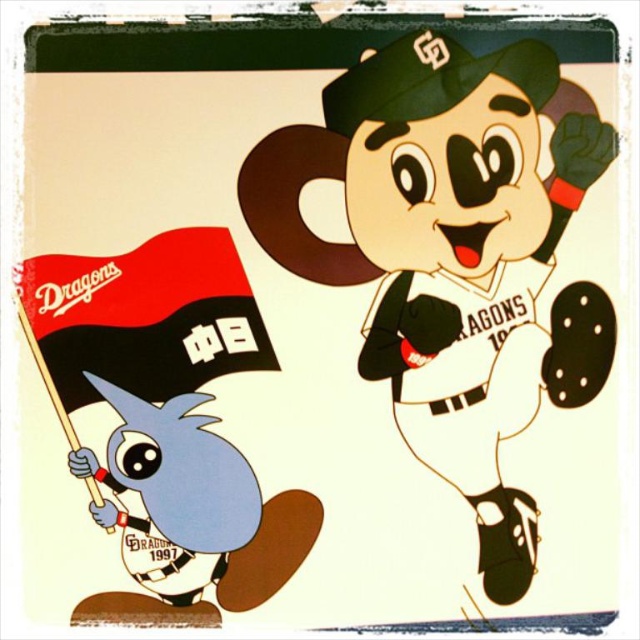
Question: Does black fabric flag at lower left appear on the right side of blue matte bird at lower left?

Choices:
 (A) yes
 (B) no

Answer: (B)

Question: Among these objects, which one is farthest from the camera?

Choices:
 (A) black fabric flag at lower left
 (B) blue matte bird at lower left
 (C) matte black mascot at right

Answer: (C)

Question: Estimate the real-world distances between objects in this image. Which object is closer to the blue matte bird at lower left?

Choices:
 (A) black fabric flag at lower left
 (B) matte black mascot at right

Answer: (A)

Question: Is matte black mascot at right behind blue matte bird at lower left?

Choices:
 (A) yes
 (B) no

Answer: (A)

Question: Does black fabric flag at lower left appear on the right side of blue matte bird at lower left?

Choices:
 (A) no
 (B) yes

Answer: (A)

Question: Which point is closer to the camera?

Choices:
 (A) (84, 264)
 (B) (147, 515)

Answer: (B)